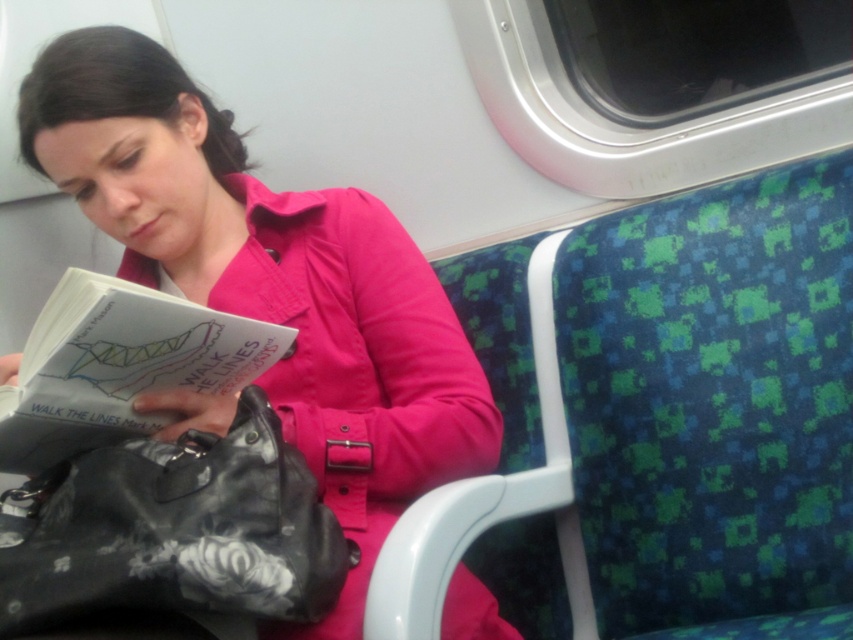
Based on the photo, can you confirm if pink fabric jacket at center is taller than black leather bag at lower left?

Correct, pink fabric jacket at center is much taller as black leather bag at lower left.

Can you confirm if pink fabric jacket at center is shorter than black leather bag at lower left?

In fact, pink fabric jacket at center may be taller than black leather bag at lower left.

Is point (480, 436) farther from camera compared to point (33, 620)?

Yes, point (480, 436) is farther from viewer.

You are a GUI agent. You are given a task and a screenshot of the screen. Output one action in this format:
    pyautogui.click(x=<x>, y=<y>)
    Task: Click on the pink fabric jacket at center
    
    Given the screenshot: What is the action you would take?
    pyautogui.click(x=271, y=282)

Does pink fabric jacket at center have a larger size compared to white paper book at center?

Yes.

Can you confirm if pink fabric jacket at center is wider than white paper book at center?

Yes, pink fabric jacket at center is wider than white paper book at center.

Is point (368, 472) farther from viewer compared to point (102, 275)?

That is False.

Locate an element on the screen. pink fabric jacket at center is located at coordinates [271, 282].

Is point (184, 442) more distant than point (41, 403)?

Yes, it is.

Between point (71, 564) and point (100, 282), which one is positioned behind?

Point (100, 282)

Find the location of a particular element. black leather bag at lower left is located at coordinates (173, 531).